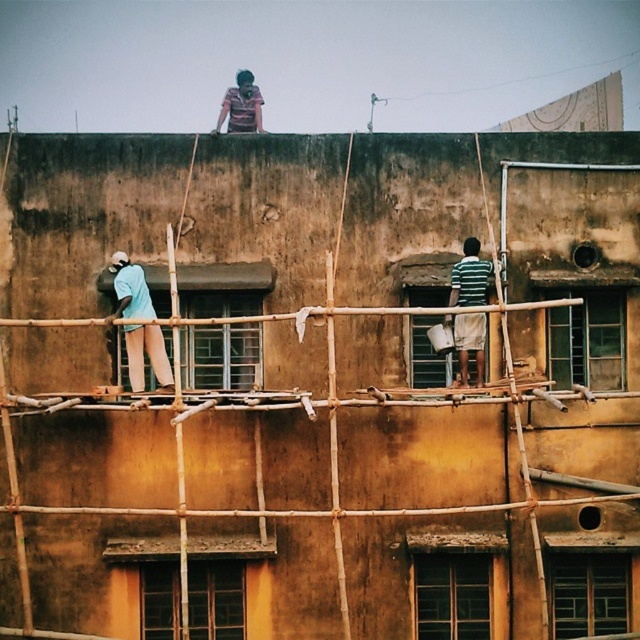
You are a safety inspector checking the construction site. You notice two items in the foreground of the image. One is the light blue fabric at left and the other is the striped cotton shirt at center. Based on the spatial relationship between them, which item is more likely to be part of the workers protective gear?

The light blue fabric at left is wider than the striped cotton shirt at center, so it is more likely to be part of the workers protective gear as it can cover a larger area for safety purposes.

You are a safety inspector checking the construction site. You notice two items in the image, the light blue fabric at left and the striped fabric shirt at upper center. Which item is smaller in size?

The light blue fabric at left is smaller than the striped fabric shirt at upper center according to the description.